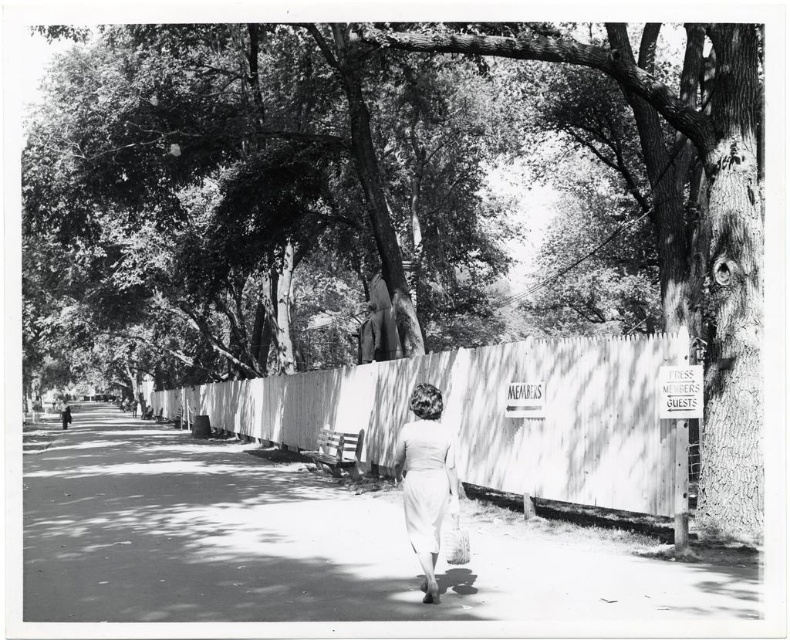
Question: Which point is closer to the camera?

Choices:
 (A) (606, 413)
 (B) (405, 435)

Answer: (B)

Question: Which point is closer to the camera?

Choices:
 (A) (401, 435)
 (B) (401, 460)
 (C) (66, 428)
 (D) (367, 532)

Answer: (B)

Question: Is white matte dress at center positioned in front of white satin dress at center?

Choices:
 (A) yes
 (B) no

Answer: (A)

Question: Is smooth concrete path at center positioned in front of white matte dress at center?

Choices:
 (A) no
 (B) yes

Answer: (B)

Question: Can you confirm if white wood fence at center is positioned to the left of white cotton dress at center?

Choices:
 (A) no
 (B) yes

Answer: (A)

Question: Estimate the real-world distances between objects in this image. Which object is closer to the white matte dress at center?

Choices:
 (A) white cotton dress at center
 (B) white wood fence at center
 (C) white satin dress at center
 (D) smooth concrete path at center

Answer: (C)